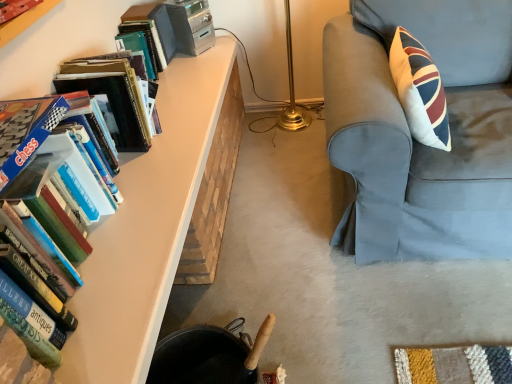
At what (x,y) coordinates should I click in order to perform the action: click on free point above matte white table at left (from a real-world perspective). Please return your answer as a coordinate pair (x, y). This screenshot has width=512, height=384. Looking at the image, I should click on (163, 152).